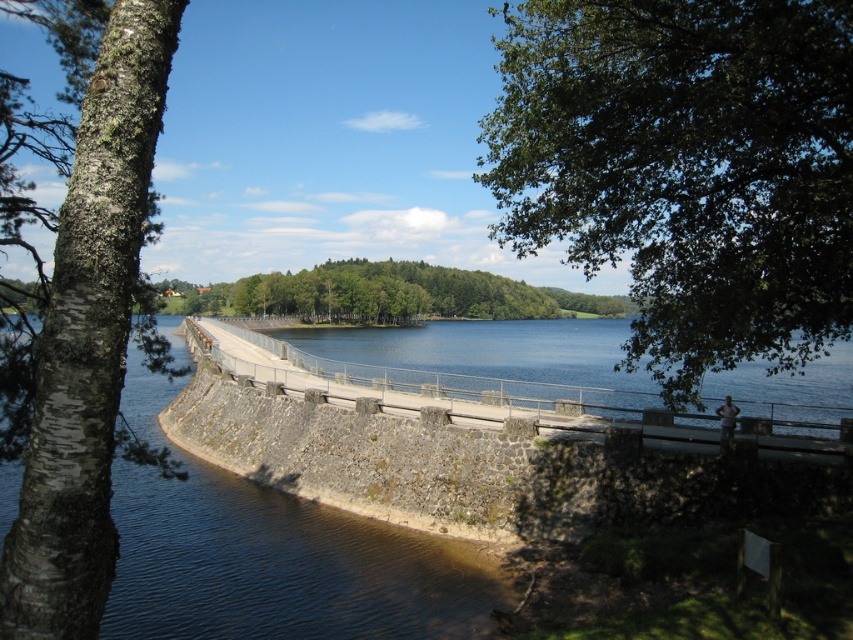
Describe the element at coordinates (86, 337) in the screenshot. I see `barky white tree at left` at that location.

You are a GUI agent. You are given a task and a screenshot of the screen. Output one action in this format:
    pyautogui.click(x=<x>, y=<y>)
    Task: Click on the barky white tree at left
    This screenshot has height=640, width=853.
    Given the screenshot: What is the action you would take?
    pyautogui.click(x=86, y=337)

Is green leafy tree at upper right bigger than smooth concrete bridge at center?

Yes.

Between point (753, 90) and point (842, 406), which one is positioned in front?

Point (753, 90) is more forward.

I want to click on green leafy tree at upper right, so click(x=686, y=170).

Can you confirm if barky white tree at left is thinner than smooth concrete bridge at center?

Indeed, barky white tree at left has a lesser width compared to smooth concrete bridge at center.

Which is in front, point (96, 474) or point (428, 330)?

Positioned in front is point (96, 474).

This screenshot has width=853, height=640. Find the location of `barky white tree at left`. barky white tree at left is located at coordinates (86, 337).